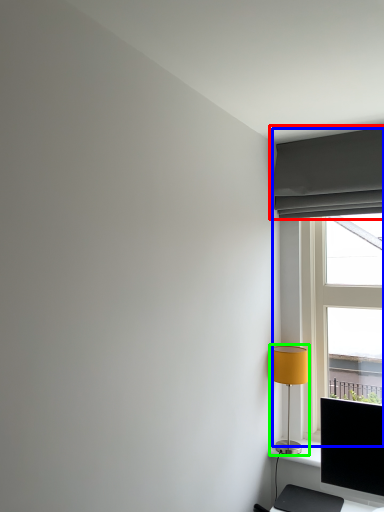
Question: Which is farther away from curtain (highlighted by a red box)? window (highlighted by a blue box) or lamp (highlighted by a green box)?

Choices:
 (A) window
 (B) lamp

Answer: (B)